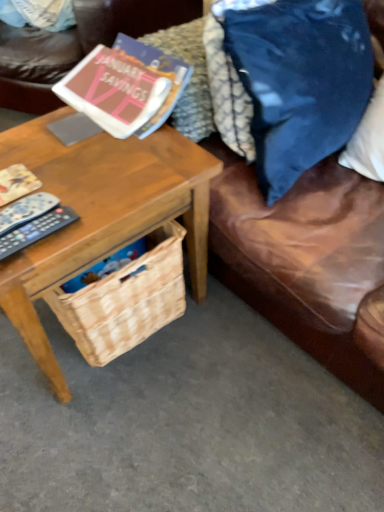
In order to click on free spot behind black plastic remote at left, which is the 1th remote control from top to bottom in this screenshot , I will do `click(59, 162)`.